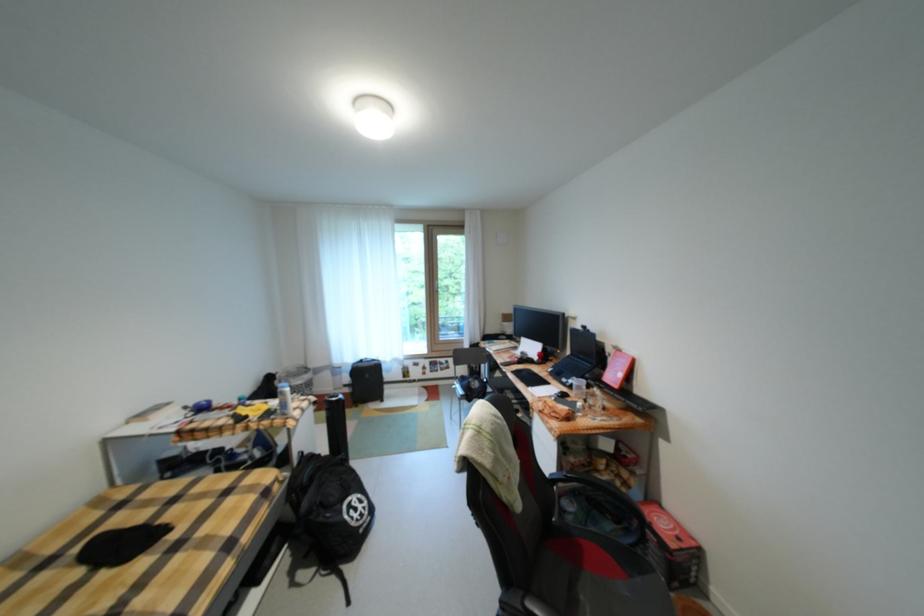
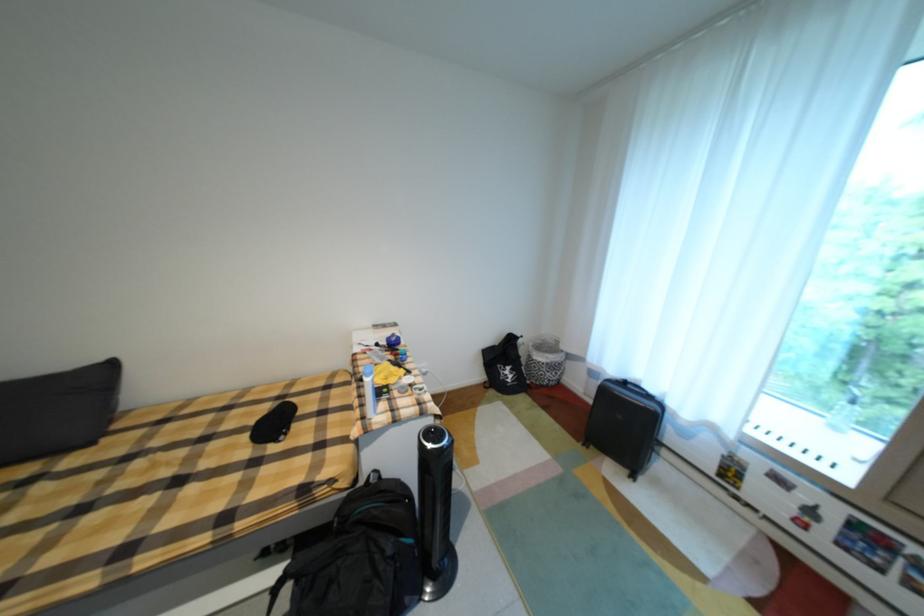
In the second image, find the point that corresponds to [371,362] in the first image.

(635, 384)